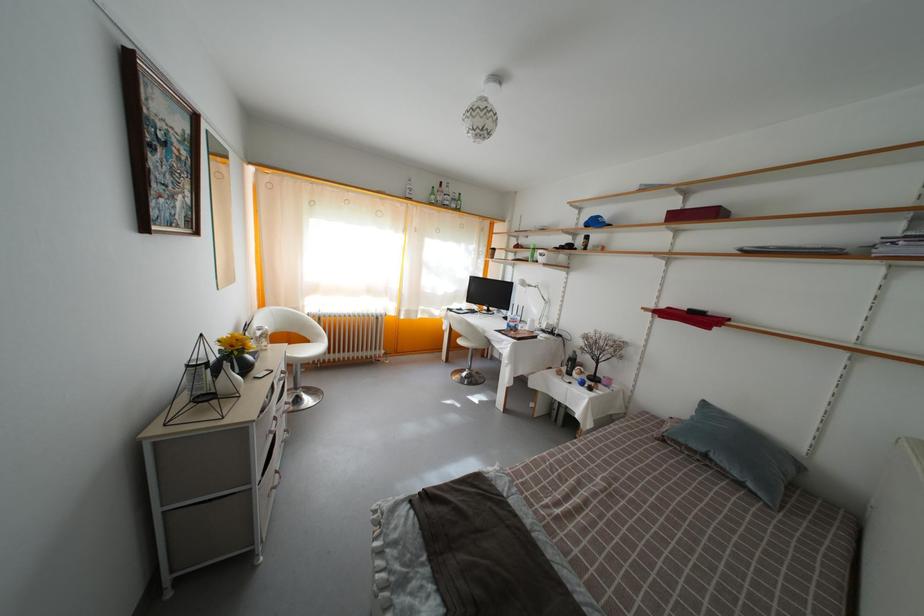
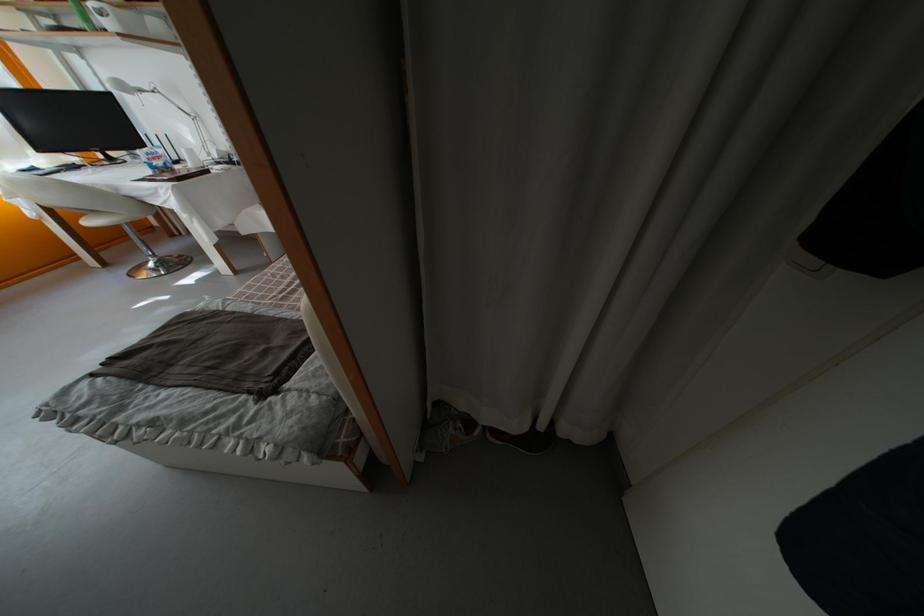
Where in the second image is the point corresponding to the point at 519,326 from the first image?

(160, 161)